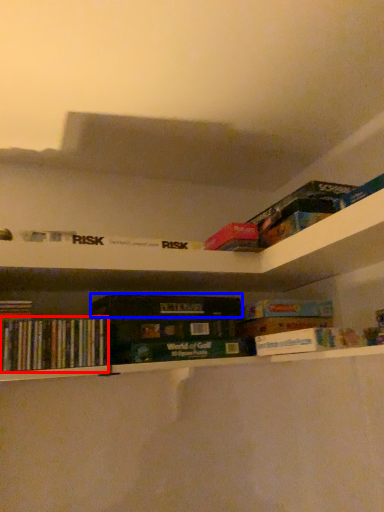
Question: Which object is closer to the camera taking this photo, book (highlighted by a red box) or paperback book (highlighted by a blue box)?

Choices:
 (A) book
 (B) paperback book

Answer: (A)